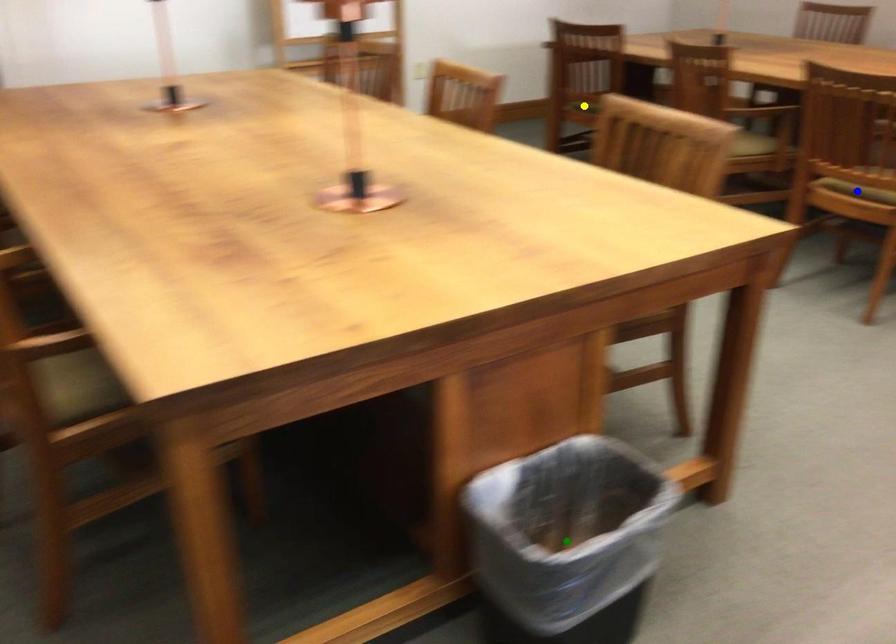
Order these from nearest to farthest:
- green point
- yellow point
- blue point

yellow point
blue point
green point